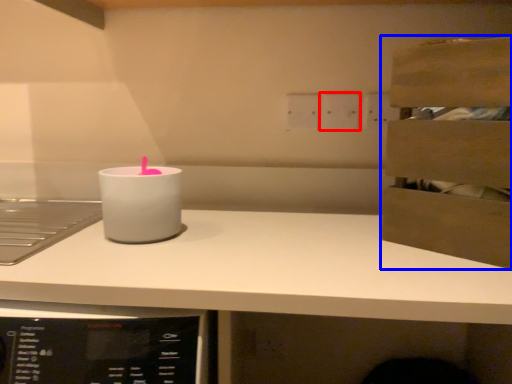
Question: Which object appears farthest to the camera in this image, electric outlet (highlighted by a red box) or cabinetry (highlighted by a blue box)?

Choices:
 (A) electric outlet
 (B) cabinetry

Answer: (A)